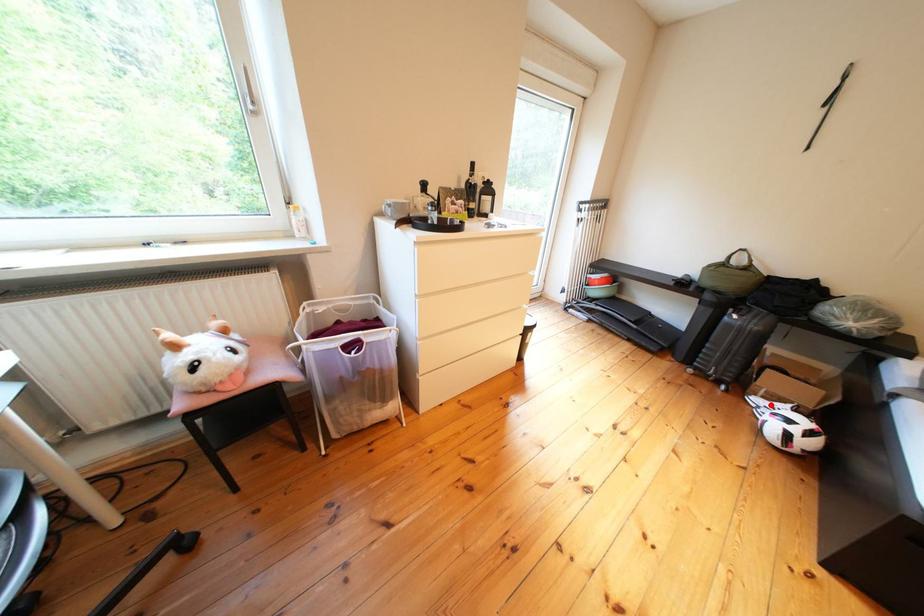
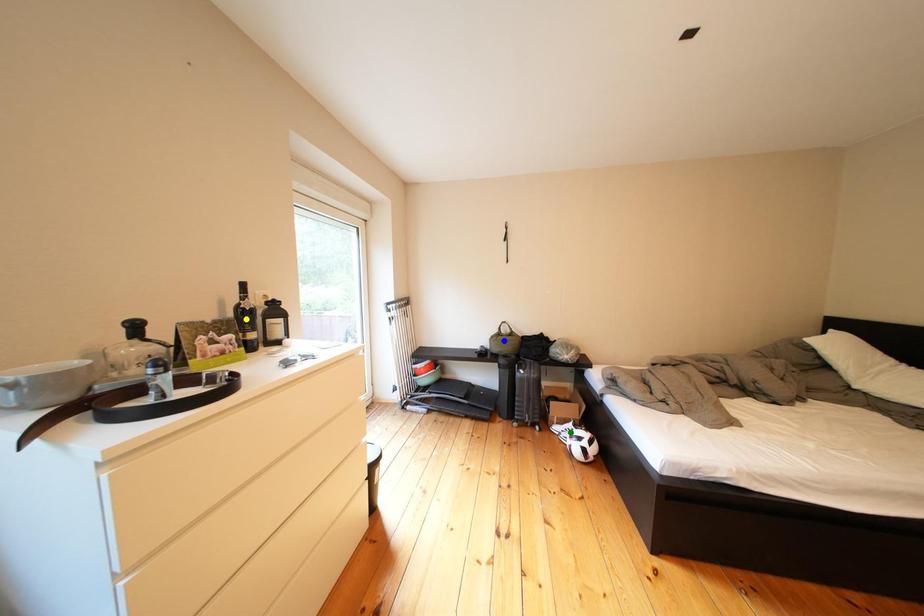
Question: I am providing you with two images of the same scene from different viewpoints. A red point is marked on the first image. You are given multiple points on the second image. Which mark in image 2 goes with the point in image 1?

Choices:
 (A) yellow point
 (B) blue point
 (C) green point

Answer: (C)